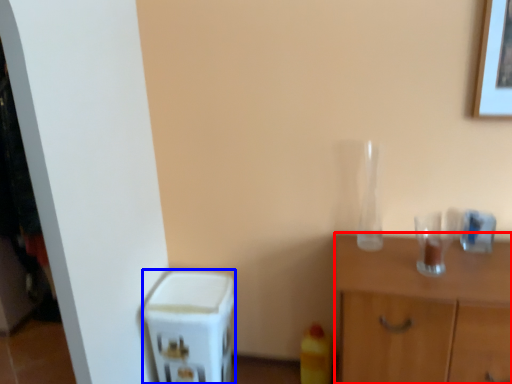
Question: Among these objects, which one is farthest to the camera, nightstand (highlighted by a red box) or appliance (highlighted by a blue box)?

Choices:
 (A) nightstand
 (B) appliance

Answer: (B)